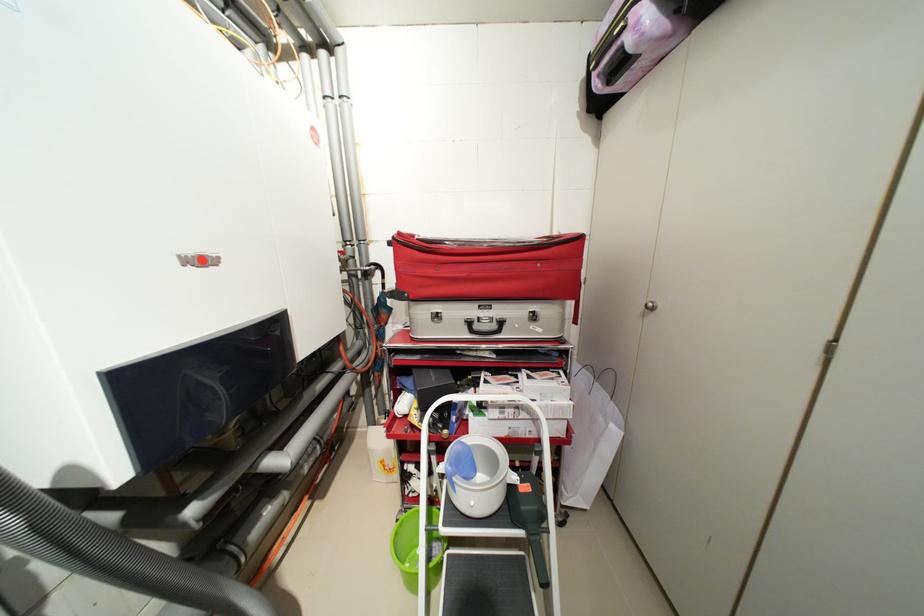
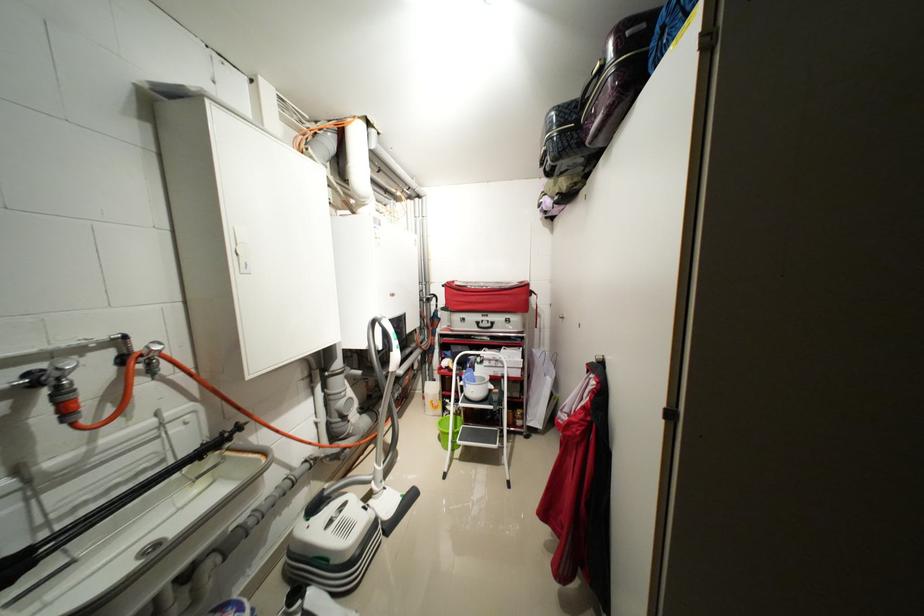
In the second image, find the point that corresponds to the point at 508,408 in the first image.

(496, 361)